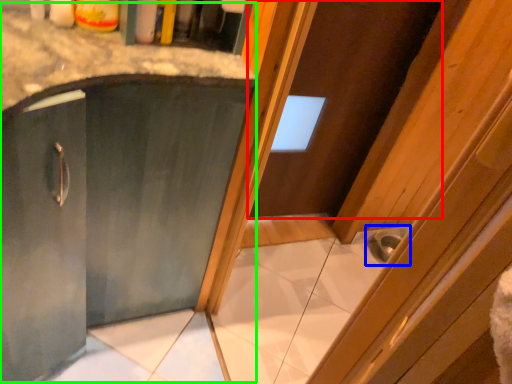
Question: Estimate the real-world distances between objects in this image. Which object is closer to door (highlighted by a red box), sink (highlighted by a blue box) or cabinetry (highlighted by a green box)?

Choices:
 (A) sink
 (B) cabinetry

Answer: (A)